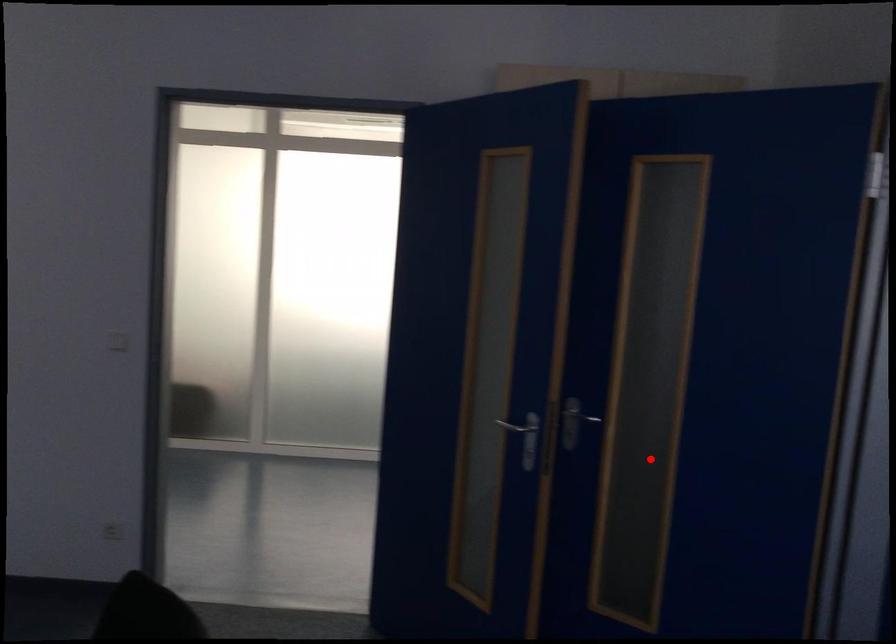
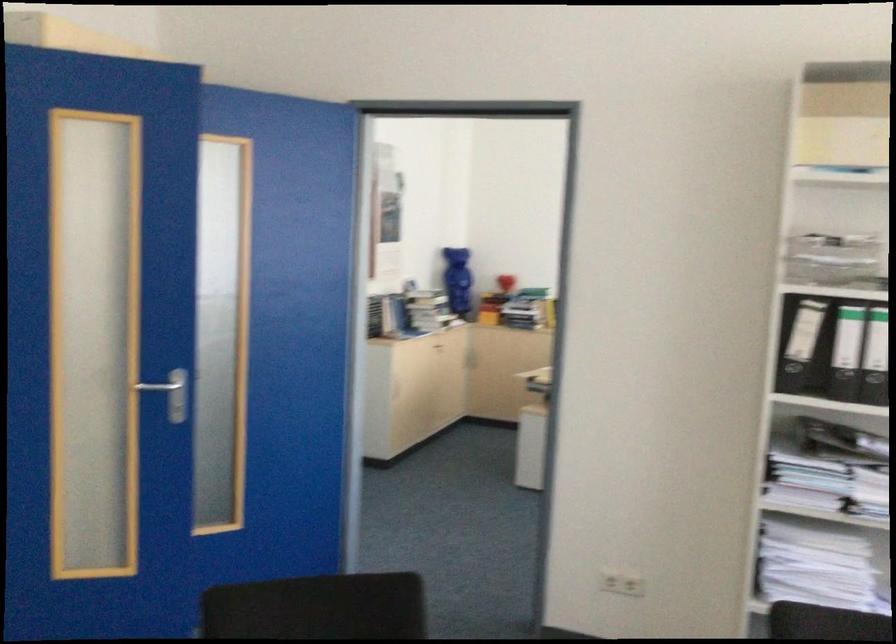
Question: I am providing you with two images of the same scene from different viewpoints. A red point is marked on the first image. At the location where the point appears in image 1, is it still visible in image 2?

Choices:
 (A) Yes
 (B) No

Answer: (A)